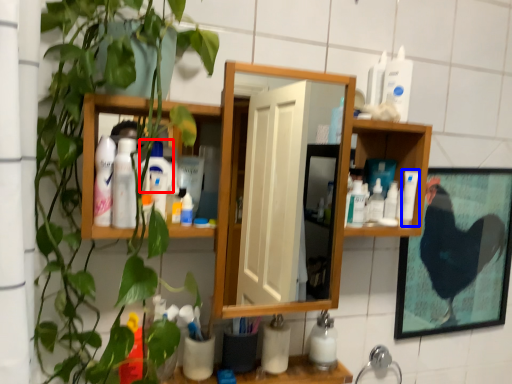
Question: Which of the following is the farthest to the observer, cleaning product (highlighted by a red box) or cleaning product (highlighted by a blue box)?

Choices:
 (A) cleaning product
 (B) cleaning product

Answer: (B)